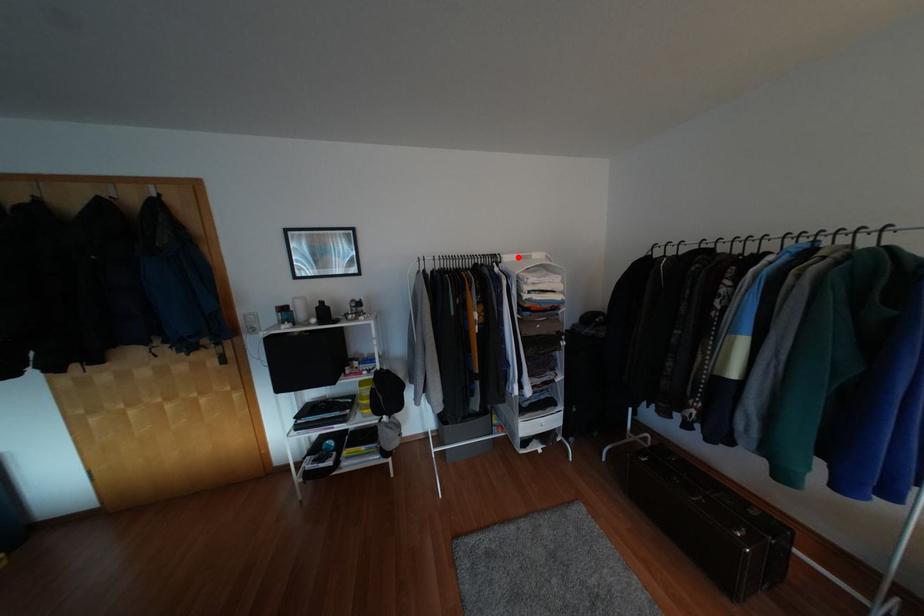
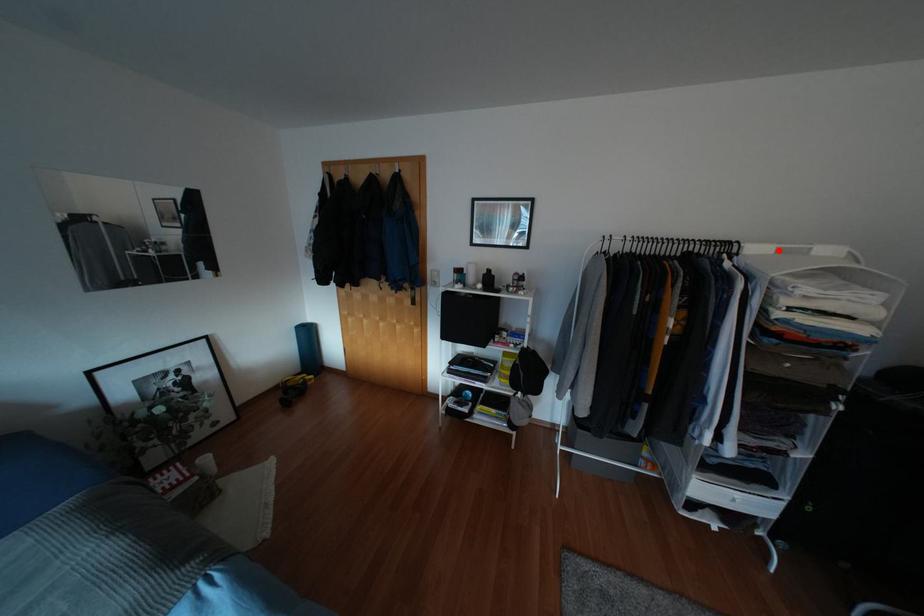
I am providing you with two images of the same scene from different viewpoints. A red point is marked on the first image and another point is marked on the second image. Are the points marked in image1 and image2 representing the same 3D position?

Yes